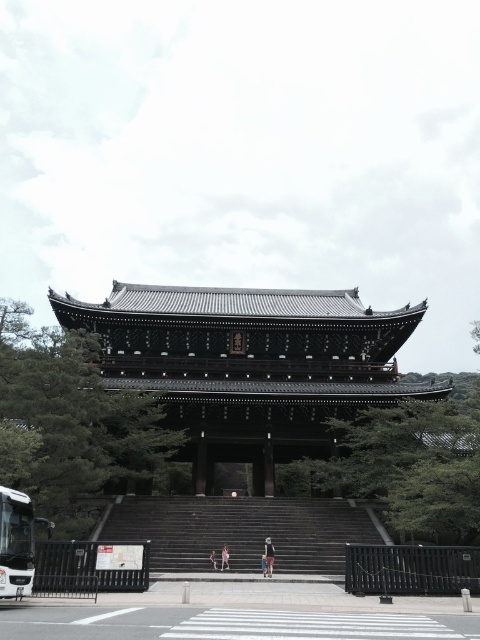
Question: Is dark gray stone stairs at center below white metallic bus at lower left?

Choices:
 (A) no
 (B) yes

Answer: (B)

Question: Which object is positioned farthest from the white metallic bus at lower left?

Choices:
 (A) dark gray stone stairs at center
 (B) light purple fabric pants at center
 (C) shiny dark wood temple at center
 (D) light blue denim shorts at center

Answer: (C)

Question: Is shiny dark wood temple at center to the right of white metallic bus at lower left from the viewer's perspective?

Choices:
 (A) yes
 (B) no

Answer: (A)

Question: Does shiny dark wood temple at center have a smaller size compared to white metallic bus at lower left?

Choices:
 (A) no
 (B) yes

Answer: (A)

Question: Among these points, which one is nearest to the camera?

Choices:
 (A) click(x=271, y=557)
 (B) click(x=24, y=570)
 (C) click(x=278, y=502)
 (D) click(x=225, y=552)

Answer: (B)

Question: Which object is positioned closest to the dark gray stone stairs at center?

Choices:
 (A) shiny dark wood temple at center
 (B) light purple fabric pants at center
 (C) light brown fabric pants at center

Answer: (C)